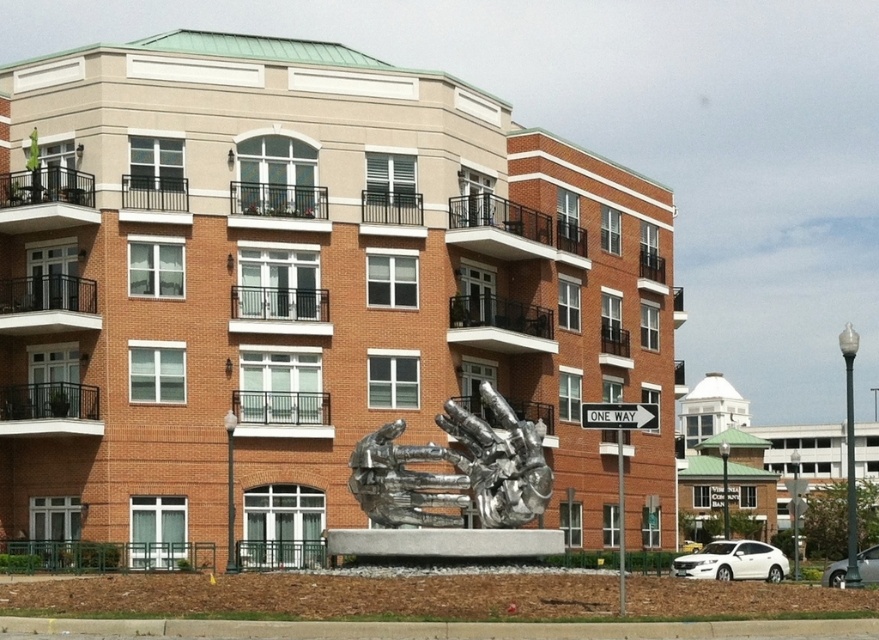
You are a delivery driver approaching the building and need to locate the loading dock. The silver metallic hands at center and the white plastic street sign at center right are visible from your vehicle. Which object should you look above to find the loading dock location?

The white plastic street sign at center right is above the silver metallic hands at center, so you should look above the white plastic street sign at center right to find the loading dock location.

You are a delivery person trying to park your van between the silver metallic hands at center and the white plastic street sign at center right. The van is 2 meters wide. Can you fit the van between them?

The silver metallic hands at center has a lesser width compared to white plastic street sign at center right. Since the van is 2 meters wide, you can fit the van between them if the distance between the two objects is at least 2 meters. However, the description only provides information about their widths, not the distance between them. Without knowing the actual spacing between the silver metallic hands at center and the white plastic street sign at center right, it is impossible to determine if the van is

A delivery person needs to place a package between the silver metallic hands at center and the white plastic street sign at center right. The package requires a space of 5 meters. Is there enough space between them?

The silver metallic hands at center is 5.75 meters away from the white plastic street sign at center right, so yes, there is enough space to place the package between them since the distance is greater than 5 meters.